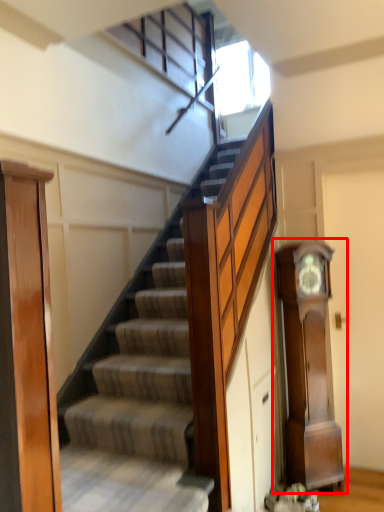
Question: From the image's perspective, what is the correct spatial relationship of clock (annotated by the red box) in relation to door?

Choices:
 (A) above
 (B) below

Answer: (B)